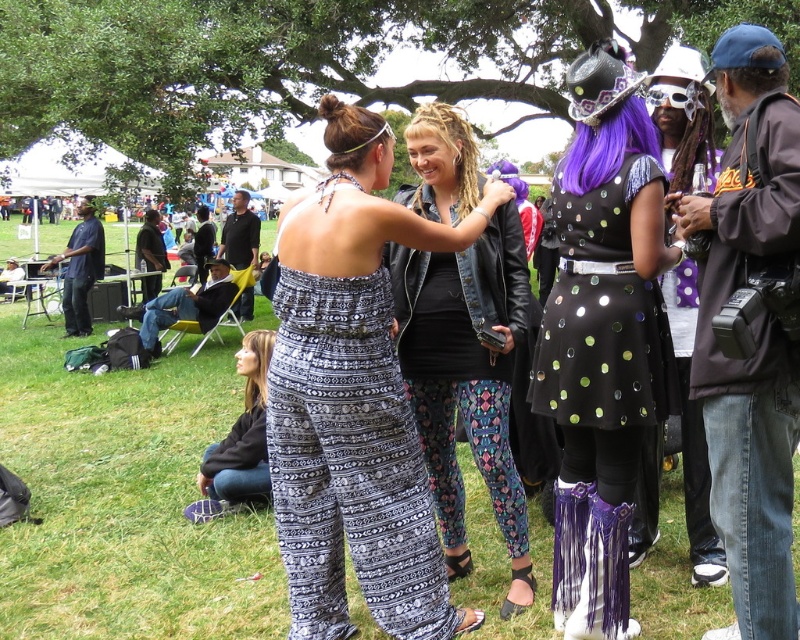
You are a photographer at the event and want to capture both the patterned fabric jumpsuit at center and the shiny sequined dress at center in the same photo. Which one should you focus on first to ensure both are in frame?

The patterned fabric jumpsuit at center is positioned under the shiny sequined dress at center, so you should focus on the shiny sequined dress at center first to ensure both are in frame.

You are a photographer at the event and want to capture a photo of both the sparkly black dress at center and the printed fabric pants at center. To ensure both are fully visible in the frame, which one should you focus on first?

The sparkly black dress at center is taller than the printed fabric pants at center, so you should focus on the sparkly black dress at center first to ensure its full height is captured before adjusting the frame for the shorter printed fabric pants at center.

You are at a festival and want to locate the sparkly black dress at center and the printed fabric pants at center. Which one is positioned to the right?

The sparkly black dress at center is to the right of the printed fabric pants at center.